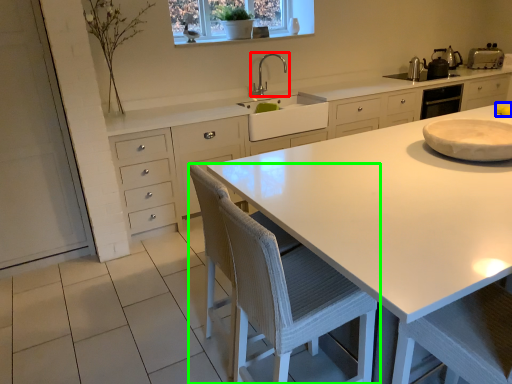
Question: Considering the real-world distances, which object is closest to tap (highlighted by a red box)? food (highlighted by a blue box) or chair (highlighted by a green box).

Choices:
 (A) food
 (B) chair

Answer: (A)